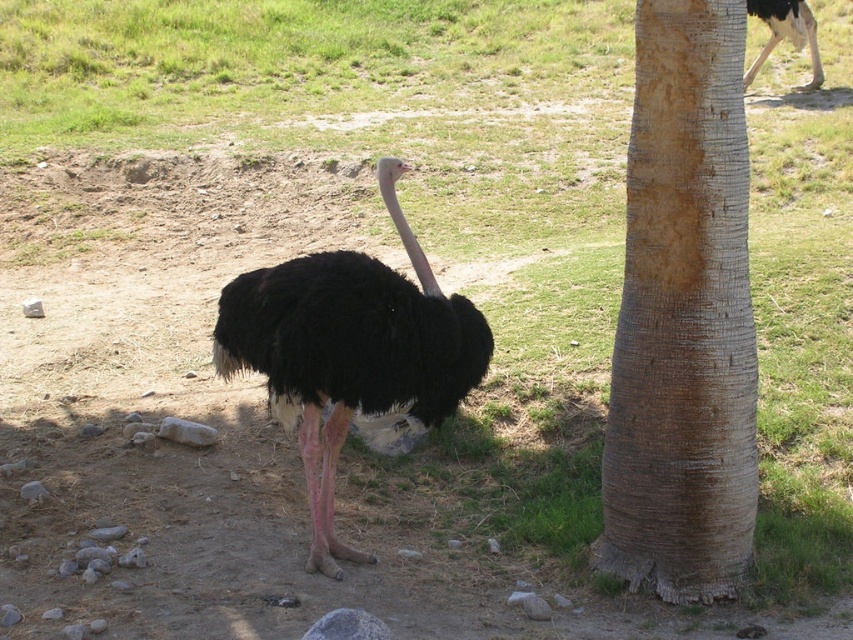
Question: Which of the following is the closest to the observer?

Choices:
 (A) (415, 396)
 (B) (682, 392)

Answer: (B)

Question: Which object is the farthest from the black feathered head at center?

Choices:
 (A) brown rough bark at right
 (B) black feathered ostrich at center

Answer: (A)

Question: Can you confirm if brown rough bark at right is positioned to the left of black feathered head at center?

Choices:
 (A) no
 (B) yes

Answer: (A)

Question: Which point is closer to the camera?

Choices:
 (A) (711, 150)
 (B) (384, 180)
 (C) (321, 497)

Answer: (A)

Question: Considering the relative positions of brown rough bark at right and black feathered ostrich at center in the image provided, where is brown rough bark at right located with respect to black feathered ostrich at center?

Choices:
 (A) left
 (B) right

Answer: (B)

Question: Is brown rough bark at right positioned before black feathered ostrich at center?

Choices:
 (A) yes
 (B) no

Answer: (A)